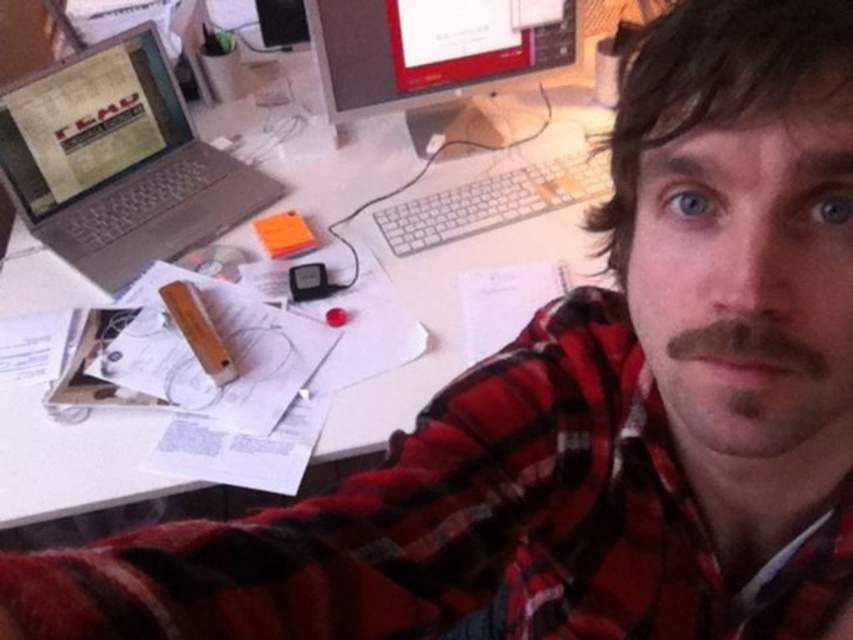
Can you confirm if red plaid shirt at center is taller than silver metallic laptop at left?

No, red plaid shirt at center is not taller than silver metallic laptop at left.

Is red plaid shirt at center below silver metallic laptop at left?

Yes, red plaid shirt at center is below silver metallic laptop at left.

The width and height of the screenshot is (853, 640). What do you see at coordinates (461, 528) in the screenshot?
I see `red plaid shirt at center` at bounding box center [461, 528].

Locate an element on the screen. red plaid shirt at center is located at coordinates (461, 528).

Does silver metallic laptop at left have a greater width compared to matte black monitor at upper center?

No.

Between silver metallic laptop at left and matte black monitor at upper center, which one appears on the right side from the viewer's perspective?

matte black monitor at upper center

Locate an element on the screen. This screenshot has height=640, width=853. silver metallic laptop at left is located at coordinates (119, 163).

Where is `silver metallic laptop at left`? The image size is (853, 640). silver metallic laptop at left is located at coordinates (119, 163).

Who is more forward, (405, 301) or (415, 40)?

Point (405, 301) is in front.

Based on the photo, is white paper at upper center shorter than matte black monitor at upper center?

Incorrect, white paper at upper center's height does not fall short of matte black monitor at upper center's.

Is point (583, 124) more distant than point (325, 24)?

Yes.

This screenshot has height=640, width=853. In order to click on white paper at upper center in this screenshot , I will do `click(463, 266)`.